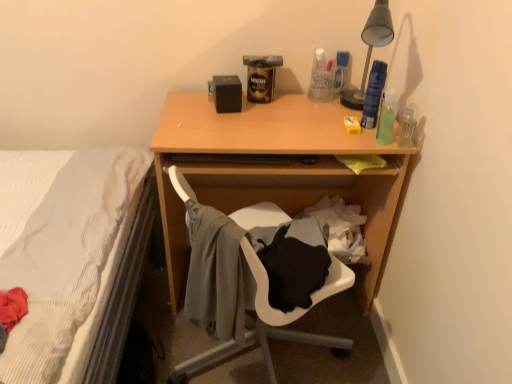
What are the coordinates of `free area in between translucent plastic spray can at upper right, positioned as the second bottle in back-to-front order, and black matte speaker at upper center` in the screenshot? It's located at (289, 112).